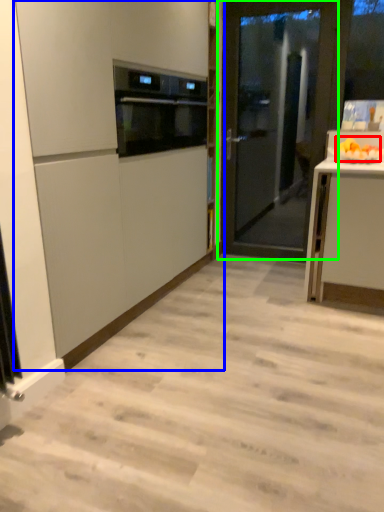
Question: Based on their relative distances, which object is nearer to fruit (highlighted by a red box)? Choose from cabinetry (highlighted by a blue box) and door (highlighted by a green box).

Choices:
 (A) cabinetry
 (B) door

Answer: (B)